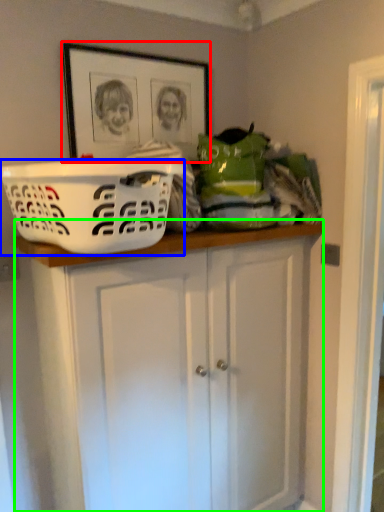
Question: Estimate the real-world distances between objects in this image. Which object is farther from picture frame (highlighted by a red box), basket (highlighted by a blue box) or cabinetry (highlighted by a green box)?

Choices:
 (A) basket
 (B) cabinetry

Answer: (B)